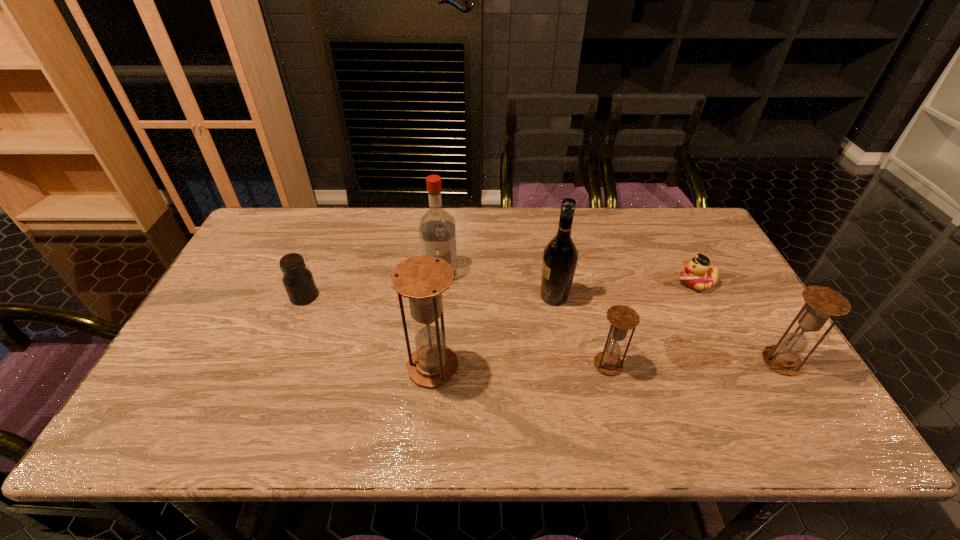
Locate an element on the screen. The width and height of the screenshot is (960, 540). the second object from right to left is located at coordinates (696, 274).

Where is `vacant space situated on the back of the tallest hourglass`? Image resolution: width=960 pixels, height=540 pixels. vacant space situated on the back of the tallest hourglass is located at coordinates 443,265.

Identify the location of vacant region located 0.100m on the back of the fifth object from left to right. Image resolution: width=960 pixels, height=540 pixels. (597, 323).

Where is `vacant position located 0.160m on the left of the fourth tallest object`? vacant position located 0.160m on the left of the fourth tallest object is located at coordinates (699, 361).

The height and width of the screenshot is (540, 960). I want to click on vacant region located on the back of the second shortest object, so click(317, 266).

I want to click on blank space located 0.330m on the label of the wine bottle, so coord(423,296).

The image size is (960, 540). What are the coordinates of `free spot located 0.380m on the label of the wine bottle` in the screenshot? It's located at (405, 296).

Where is `free location located on the label of the wine bottle`? The height and width of the screenshot is (540, 960). free location located on the label of the wine bottle is located at coordinates (437, 296).

Where is `free space located 0.260m on the front-facing side of the liquor`? This screenshot has width=960, height=540. free space located 0.260m on the front-facing side of the liquor is located at coordinates (433, 353).

Where is `free space located on the face of the shortest object`? free space located on the face of the shortest object is located at coordinates (626, 282).